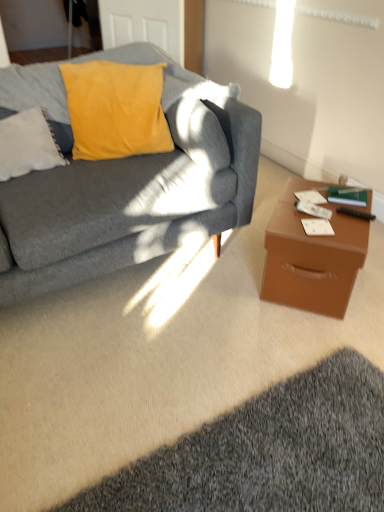
The width and height of the screenshot is (384, 512). What are the coordinates of `vacant region in front of brown leather desk at right` in the screenshot? It's located at (303, 339).